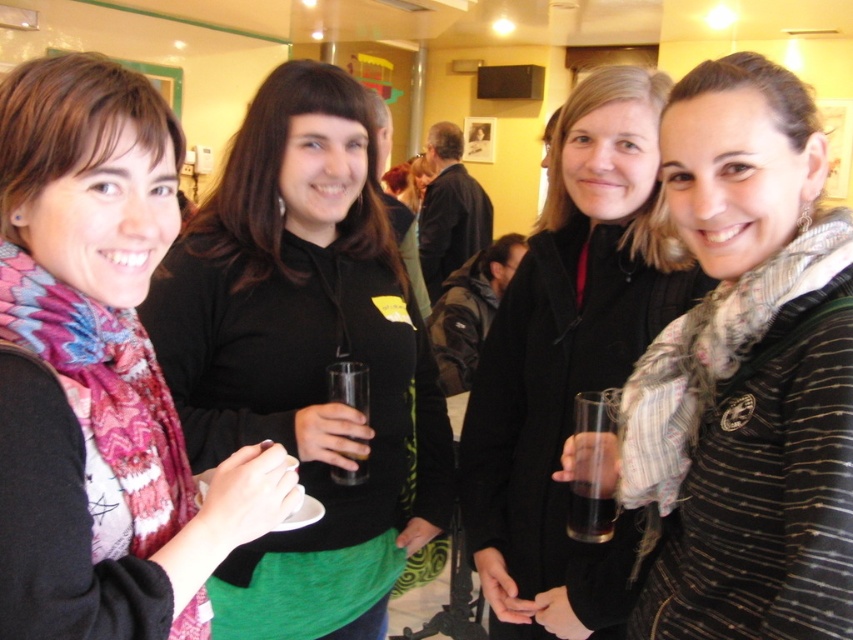
Does striped knit sweater at center come in front of translucent glass at lower right?

Yes, striped knit sweater at center is in front of translucent glass at lower right.

Is point (746, 80) in front of point (601, 513)?

That is True.

Find the location of `striped knit sweater at center`. striped knit sweater at center is located at coordinates tap(747, 374).

How far apart are matte black hoodie at center and matte scarf at left?

They are 19.19 inches apart.

Does matte black hoodie at center have a lesser width compared to matte scarf at left?

In fact, matte black hoodie at center might be wider than matte scarf at left.

Is point (192, 269) positioned behind point (25, 67)?

Yes, point (192, 269) is farther from viewer.

The height and width of the screenshot is (640, 853). Identify the location of matte black hoodie at center. (305, 358).

Who is taller, matte black hoodie at center or matte black coat at center?

With more height is matte black hoodie at center.

From the picture: Does matte black hoodie at center appear on the right side of matte black coat at center?

In fact, matte black hoodie at center is to the left of matte black coat at center.

Find the location of a particular element. The width and height of the screenshot is (853, 640). matte black hoodie at center is located at coordinates click(305, 358).

You are a GUI agent. You are given a task and a screenshot of the screen. Output one action in this format:
    pyautogui.click(x=<x>, y=<y>)
    Task: Click on the matte black hoodie at center
    
    Given the screenshot: What is the action you would take?
    pyautogui.click(x=305, y=358)